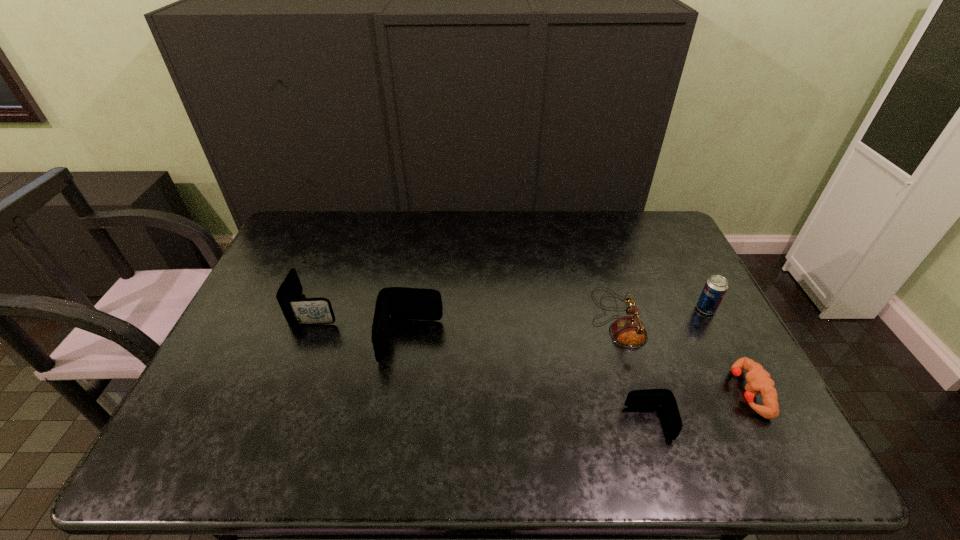
I want to click on vacant spot for a new wallet to ensure equal spacing, so 520,379.